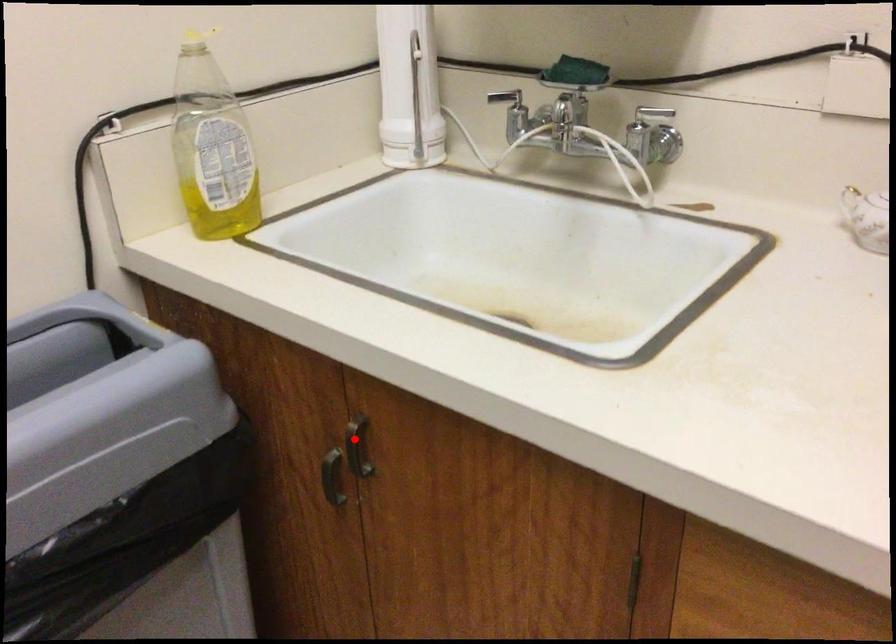
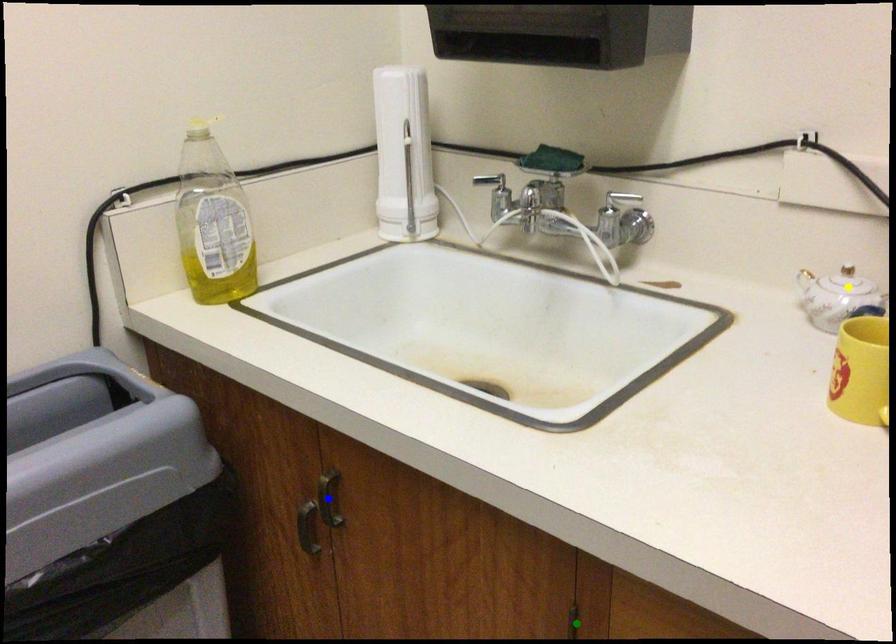
Question: I am providing you with two images of the same scene from different viewpoints. A red point is marked on the first image. You are given multiple points on the second image. Which mark in image 2 goes with the point in image 1?

Choices:
 (A) blue point
 (B) green point
 (C) yellow point

Answer: (A)